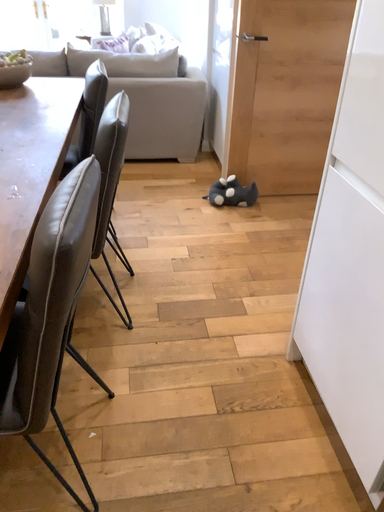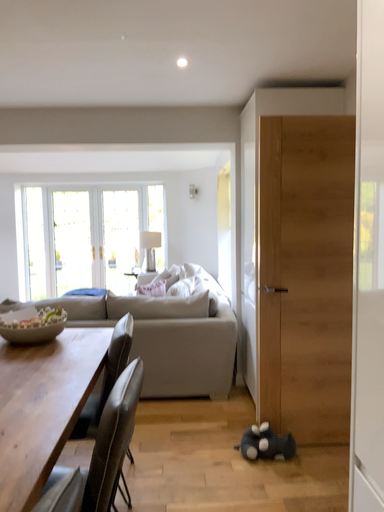
Question: How did the camera likely rotate when shooting the video?

Choices:
 (A) rotated downward
 (B) rotated upward

Answer: (B)